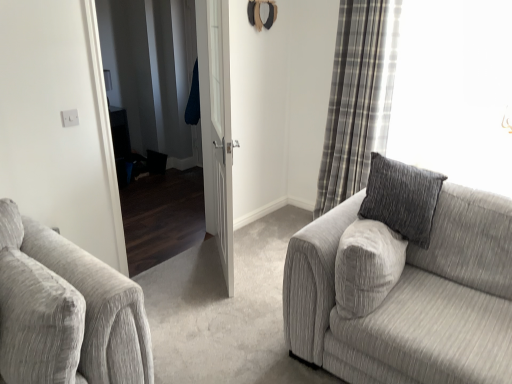
This screenshot has height=384, width=512. Describe the element at coordinates (216, 126) in the screenshot. I see `white wooden door at center` at that location.

Locate an element on the screen. The width and height of the screenshot is (512, 384). textured gray couch at right is located at coordinates (404, 283).

Where is `white wooden door at center`? white wooden door at center is located at coordinates (216, 126).

Is textured gray couch at right taller than plaid fabric curtain at right?

Incorrect, the height of textured gray couch at right is not larger of that of plaid fabric curtain at right.

From a real-world perspective, is textured gray couch at right above or below plaid fabric curtain at right?

Clearly, from a real-world perspective, textured gray couch at right is below plaid fabric curtain at right.

Which object is closer to the camera, textured gray couch at right or plaid fabric curtain at right?

textured gray couch at right is in front.

Could you tell me if textured gray couch at right is facing white wooden door at center?

No, textured gray couch at right is not turned towards white wooden door at center.

Considering the positions of objects textured gray couch at right and white wooden door at center in the image provided, who is more to the right, textured gray couch at right or white wooden door at center?

textured gray couch at right.

In the scene shown: From a real-world perspective, is textured gray couch at right on white wooden door at center?

Incorrect, from a real-world perspective, textured gray couch at right is lower than white wooden door at center.

What are the coordinates of `door on the left of textured gray couch at right` in the screenshot? It's located at (216, 126).

Is white wooden door at center a part of plaid fabric curtain at right?

Actually, white wooden door at center is outside plaid fabric curtain at right.

Is plaid fabric curtain at right aimed at white wooden door at center?

Yes, plaid fabric curtain at right is turned towards white wooden door at center.

From the image's perspective, is plaid fabric curtain at right located beneath white wooden door at center?

No.

Which is more to the left, white wooden door at center or textured gray couch at right?

white wooden door at center.

Is white wooden door at center turned away from textured gray couch at right?

No, white wooden door at center is not facing the opposite direction of textured gray couch at right.

Who is bigger, white wooden door at center or textured gray couch at right?

Bigger between the two is textured gray couch at right.

Considering the sizes of objects white wooden door at center and plaid fabric curtain at right in the image provided, who is taller, white wooden door at center or plaid fabric curtain at right?

With more height is plaid fabric curtain at right.

From the image's perspective, is white wooden door at center under plaid fabric curtain at right?

Yes, from the image's perspective, white wooden door at center is beneath plaid fabric curtain at right.

From a real-world perspective, between white wooden door at center and plaid fabric curtain at right, who is vertically lower?

In real-world perspective, white wooden door at center is lower.

Consider the image. Is white wooden door at center at the right side of plaid fabric curtain at right?

No.

Does plaid fabric curtain at right touch textured gray couch at right?

No, plaid fabric curtain at right is not in contact with textured gray couch at right.

Can you confirm if plaid fabric curtain at right is bigger than textured gray couch at right?

Incorrect, plaid fabric curtain at right is not larger than textured gray couch at right.

Is plaid fabric curtain at right positioned behind textured gray couch at right?

Yes, it is behind textured gray couch at right.

Considering the points (353, 26) and (306, 296), which point is behind, point (353, 26) or point (306, 296)?

The point (353, 26) is more distant.

What are the coordinates of `studio couch that appears on the right of plaid fabric curtain at right` in the screenshot? It's located at (404, 283).

Identify the location of door located behind the textured gray couch at right. (216, 126).

Based on their spatial positions, is textured gray couch at right or white wooden door at center further from plaid fabric curtain at right?

textured gray couch at right is positioned further to the anchor plaid fabric curtain at right.

Consider the image. Estimate the real-world distances between objects in this image. Which object is further from textured gray couch at right, plaid fabric curtain at right or white wooden door at center?

Among the two, plaid fabric curtain at right is located further to textured gray couch at right.

When comparing their distances from textured gray couch at right, does white wooden door at center or plaid fabric curtain at right seem further?

Based on the image, plaid fabric curtain at right appears to be further to textured gray couch at right.

Looking at the image, which one is located further to plaid fabric curtain at right, white wooden door at center or textured gray couch at right?

textured gray couch at right.

Looking at the image, which one is located closer to white wooden door at center, plaid fabric curtain at right or textured gray couch at right?

Among the two, plaid fabric curtain at right is located nearer to white wooden door at center.

Considering their positions, is textured gray couch at right positioned closer to white wooden door at center than plaid fabric curtain at right?

plaid fabric curtain at right is positioned closer to the anchor white wooden door at center.

You are a GUI agent. You are given a task and a screenshot of the screen. Output one action in this format:
    pyautogui.click(x=<x>, y=<y>)
    Task: Click on the door between textured gray couch at right and plaid fabric curtain at right along the z-axis
    This screenshot has width=512, height=384.
    Given the screenshot: What is the action you would take?
    pyautogui.click(x=216, y=126)